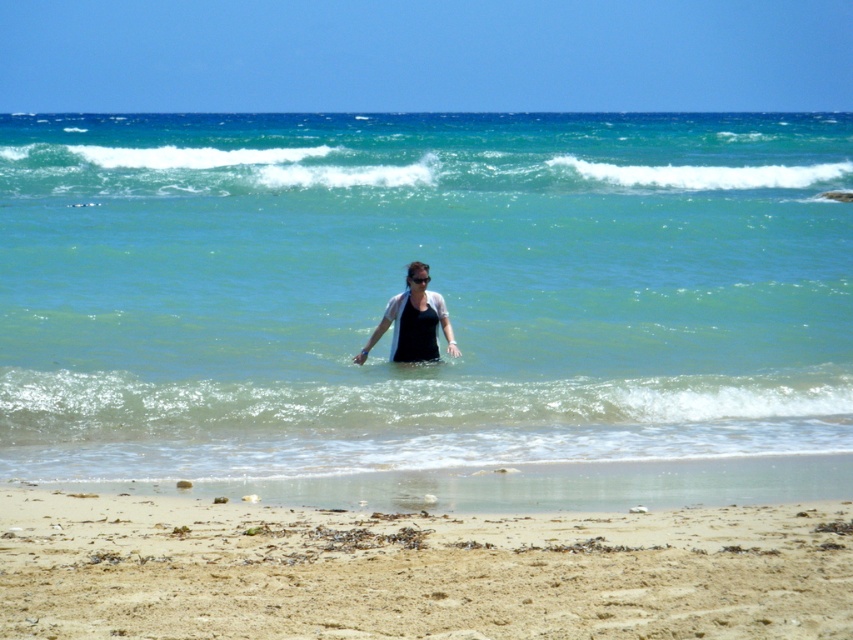
Is fine-grained sand at lower center below matte black top at center?

Indeed, fine-grained sand at lower center is positioned under matte black top at center.

Does fine-grained sand at lower center have a greater height compared to matte black top at center?

No.

Find the location of a particular element. fine-grained sand at lower center is located at coordinates (415, 570).

Who is positioned more to the right, green translucent water at upper center or matte black top at center?

matte black top at center is more to the right.

Which of these two, green translucent water at upper center or matte black top at center, stands taller?

green translucent water at upper center

Does point (801, 157) lie in front of point (393, 348)?

No, it is behind (393, 348).

Where is `green translucent water at upper center`? The image size is (853, 640). green translucent water at upper center is located at coordinates point(386,170).

Which is behind, point (189, 156) or point (387, 314)?

Point (189, 156)

Can you confirm if green translucent water at upper center is positioned to the right of black matte wetsuit at center?

In fact, green translucent water at upper center is to the left of black matte wetsuit at center.

The height and width of the screenshot is (640, 853). In order to click on green translucent water at upper center in this screenshot , I will do [x=386, y=170].